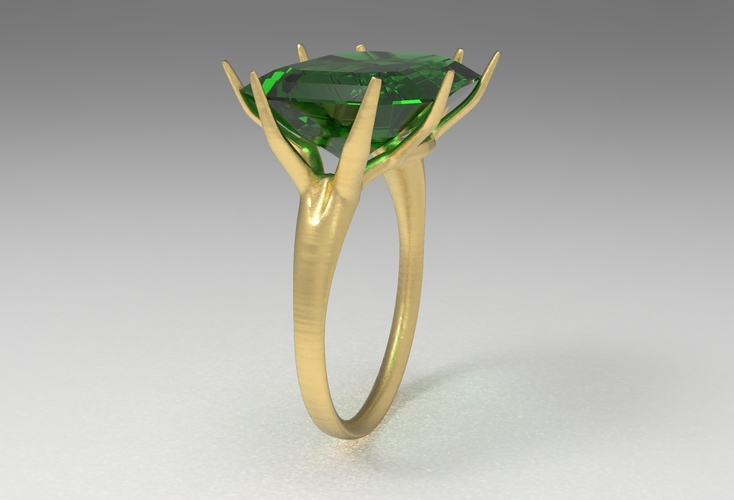
This screenshot has width=734, height=500. Identify the location of gallery. (352, 148).